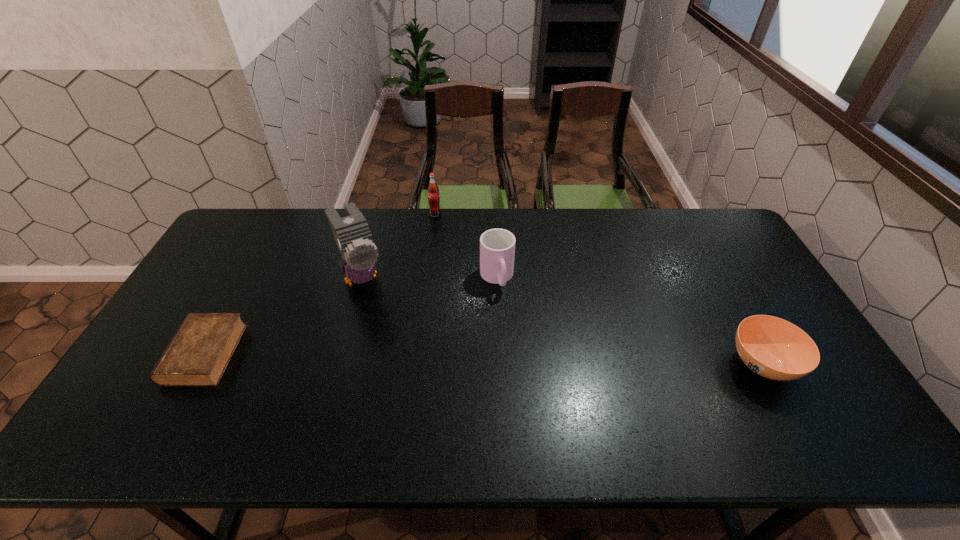
This screenshot has width=960, height=540. In order to click on vacant space at the near edge of the desktop in this screenshot , I will do `click(753, 409)`.

In the image, there is a desktop. Identify the location of vacant space at the left edge. 229,303.

Identify the location of vacant space at the far left corner of the desktop. This screenshot has height=540, width=960. (265, 229).

At what (x,y) coordinates should I click in order to perform the action: click on free space between the farthest object and the tallest object. Please return your answer as a coordinate pair (x, y). The image size is (960, 540). Looking at the image, I should click on (398, 246).

In order to click on free space between the soup bowl and the fourth shortest object in this screenshot , I will do `click(599, 289)`.

Identify the location of free space between the third tallest object and the shortest object. (350, 316).

At what (x,y) coordinates should I click in order to perform the action: click on free spot between the diary and the third shortest object. Please return your answer as a coordinate pair (x, y). The image size is (960, 540). Looking at the image, I should click on (350, 316).

This screenshot has width=960, height=540. Identify the location of vacant point located between the soup bowl and the soda bottle. (599, 289).

Locate an element on the screen. The image size is (960, 540). vacant area that lies between the soup bowl and the cup is located at coordinates (630, 321).

Image resolution: width=960 pixels, height=540 pixels. What are the coordinates of `vacant area that lies between the leftmost object and the tallest object` in the screenshot? It's located at (283, 315).